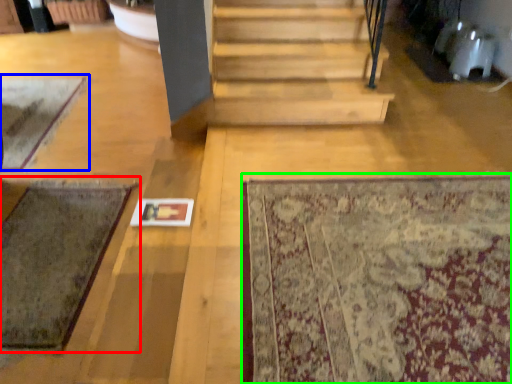
Question: Which is farther away from mat (highlighted by a red box)? mat (highlighted by a blue box) or mat (highlighted by a green box)?

Choices:
 (A) mat
 (B) mat

Answer: (B)